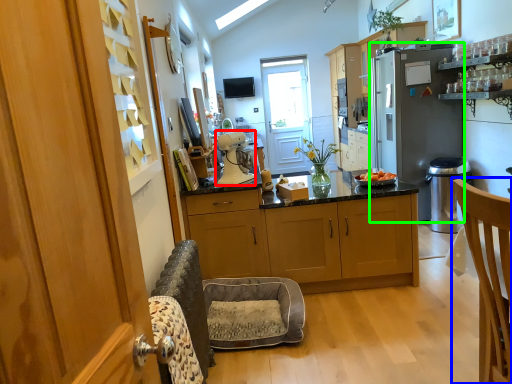
Question: Estimate the real-world distances between objects in this image. Which object is farther from kitchen appliance (highlighted by a red box), chair (highlighted by a blue box) or refrigerator (highlighted by a green box)?

Choices:
 (A) chair
 (B) refrigerator

Answer: (B)